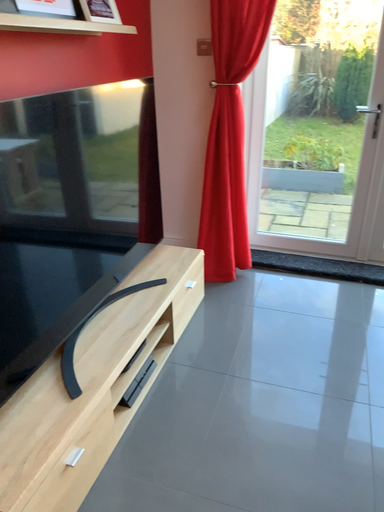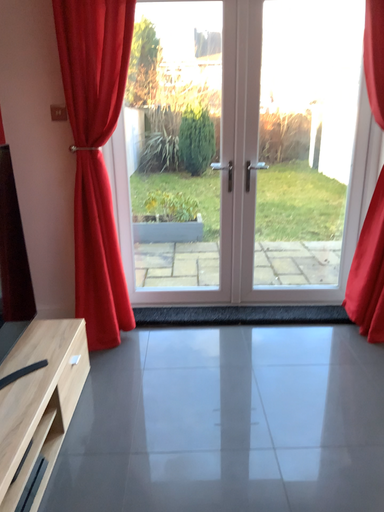
Question: How did the camera likely rotate when shooting the video?

Choices:
 (A) rotated right
 (B) rotated left

Answer: (A)